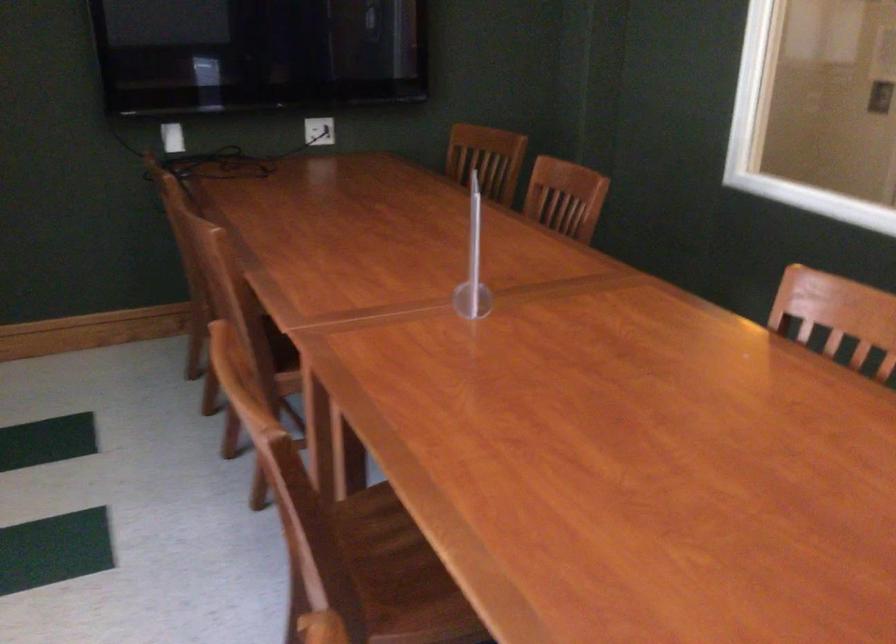
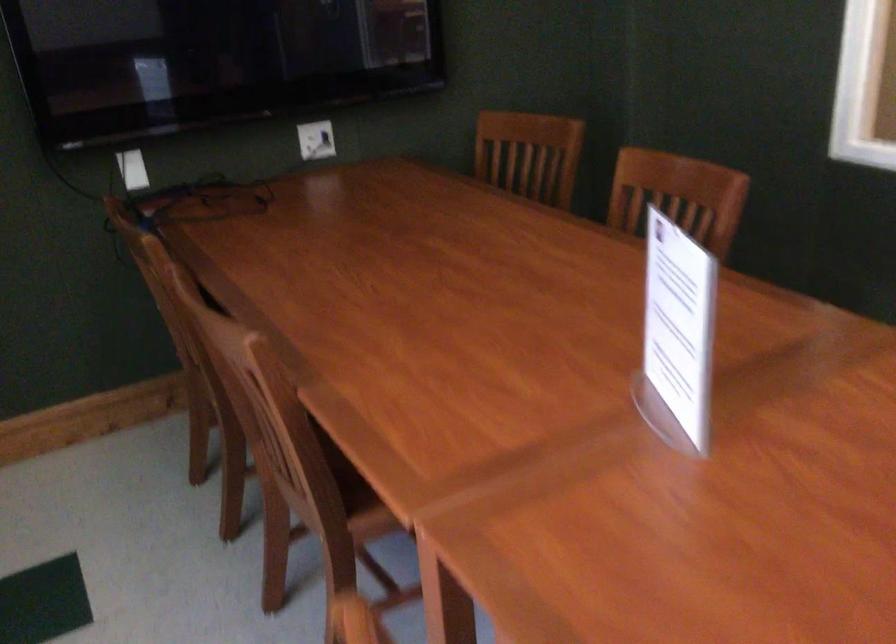
In the second image, find the point that corresponds to (571,191) in the first image.

(677, 196)